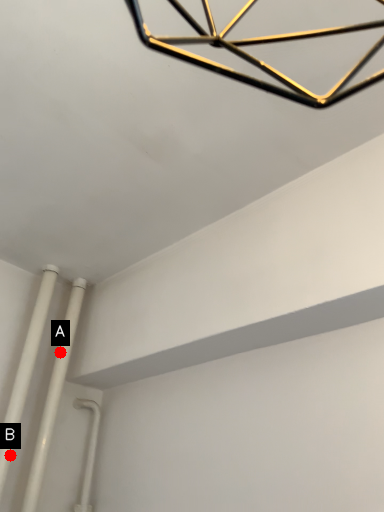
Question: Two points are circled on the image, labeled by A and B beside each circle. Which point is closer to the camera?

Choices:
 (A) A is closer
 (B) B is closer

Answer: (B)